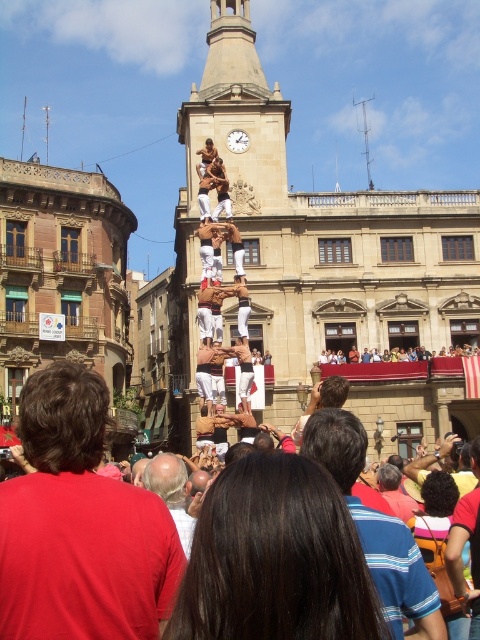
You are an architect analyzing the scene in front of the historic building. You notice the orange fabric bag at lower right and the wooden clock at center. Which object appears taller in the image?

The orange fabric bag at lower right is much taller than the wooden clock at center, so the orange fabric bag at lower right appears taller in the image.

You are standing in front of the historic building and want to take a photo of the two points mentioned. Which point is closer to you, point [356,522] or point [233,129]?

Point [356,522] is closer to the viewer than point [233,129].